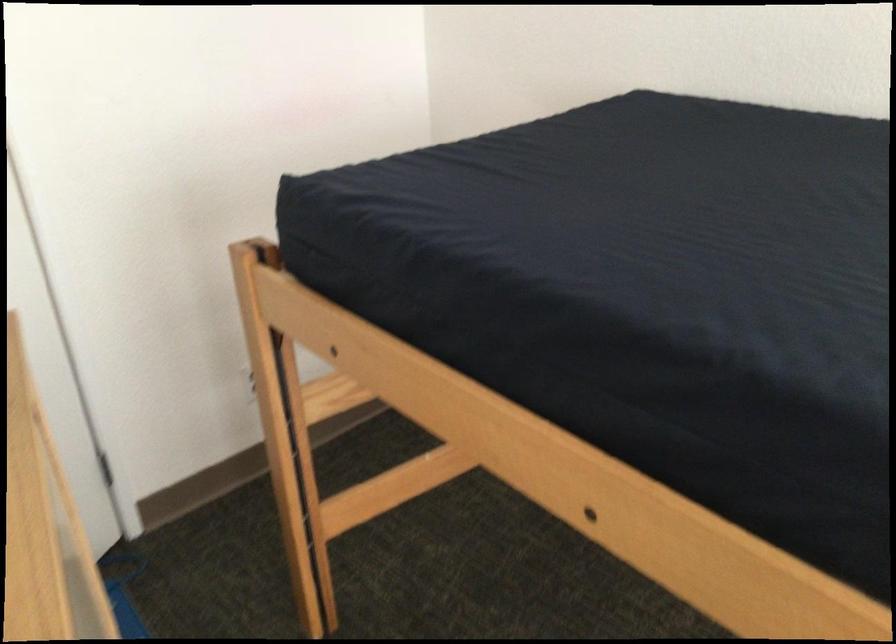
Describe the element at coordinates (636, 228) in the screenshot. Image resolution: width=896 pixels, height=644 pixels. I see `the bed sitting surface` at that location.